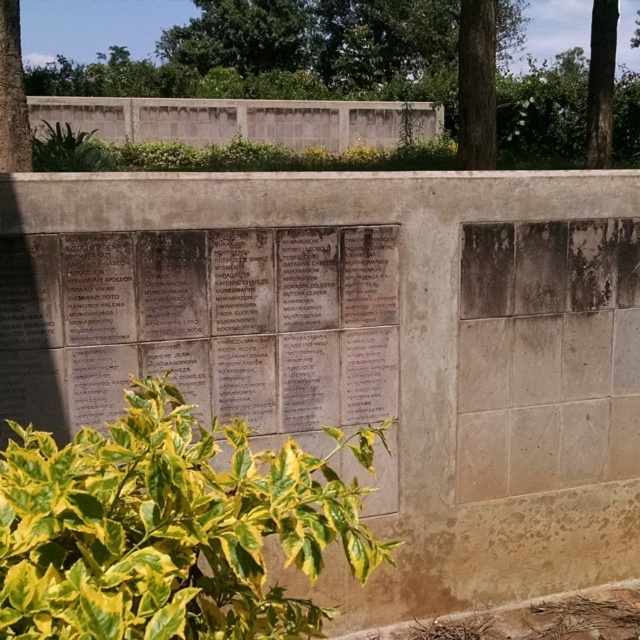
At what (x,y) coordinates should I click in order to perform the action: click on green leafy tree at upper center. Please return your answer as a coordinate pair (x, y). This screenshot has height=640, width=640. Looking at the image, I should click on (282, 54).

Does green leafy tree at upper center appear on the right side of green leafy tree at upper left?

Correct, you'll find green leafy tree at upper center to the right of green leafy tree at upper left.

Where is `green leafy tree at upper center`? Image resolution: width=640 pixels, height=640 pixels. green leafy tree at upper center is located at coordinates (282, 54).

The width and height of the screenshot is (640, 640). I want to click on green leafy tree at upper center, so click(x=282, y=54).

Does green leafy tree at upper center lie in front of green rough bark tree at upper right?

Yes.

Consider the image. Is green leafy tree at upper center to the right of green rough bark tree at upper right from the viewer's perspective?

Incorrect, green leafy tree at upper center is not on the right side of green rough bark tree at upper right.

Does point (576, 52) lie behind point (602, 147)?

Yes, it is behind point (602, 147).

This screenshot has height=640, width=640. I want to click on green leafy tree at upper center, so click(x=282, y=54).

Is green rough bark tree at upper right below green leafy tree at upper left?

No.

Consider the image. Does green rough bark tree at upper right have a lesser height compared to green leafy tree at upper left?

In fact, green rough bark tree at upper right may be taller than green leafy tree at upper left.

Where is `green rough bark tree at upper right`? This screenshot has width=640, height=640. green rough bark tree at upper right is located at coordinates (600, 83).